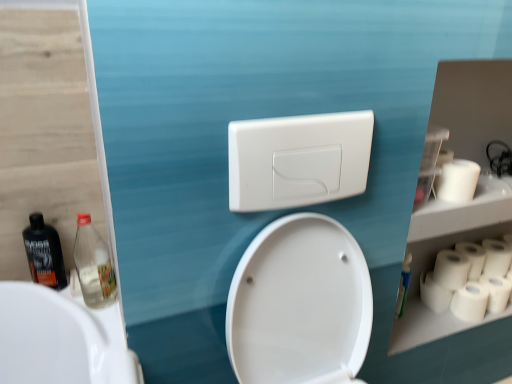
Identify the location of vacant space in front of white matte toilet paper at right, placed as the 3th toilet paper when sorted from bottom to top. The height and width of the screenshot is (384, 512). (430, 323).